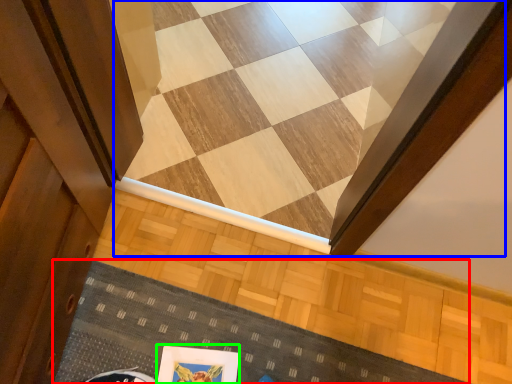
Question: Which object is the closest to the doormat (highlighted by a red box)? Choose among these: stairwell (highlighted by a blue box) or picture frame (highlighted by a green box).

Choices:
 (A) stairwell
 (B) picture frame

Answer: (B)